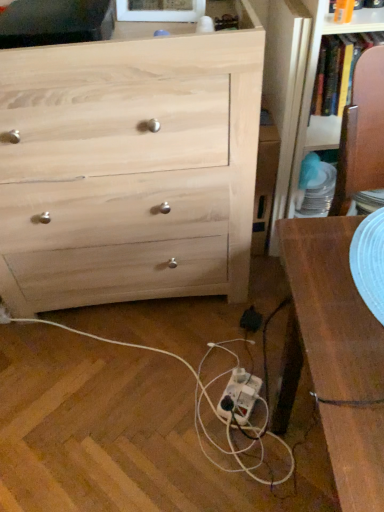
I want to click on vacant space to the right of white plastic extension cord at lower center, so click(x=269, y=390).